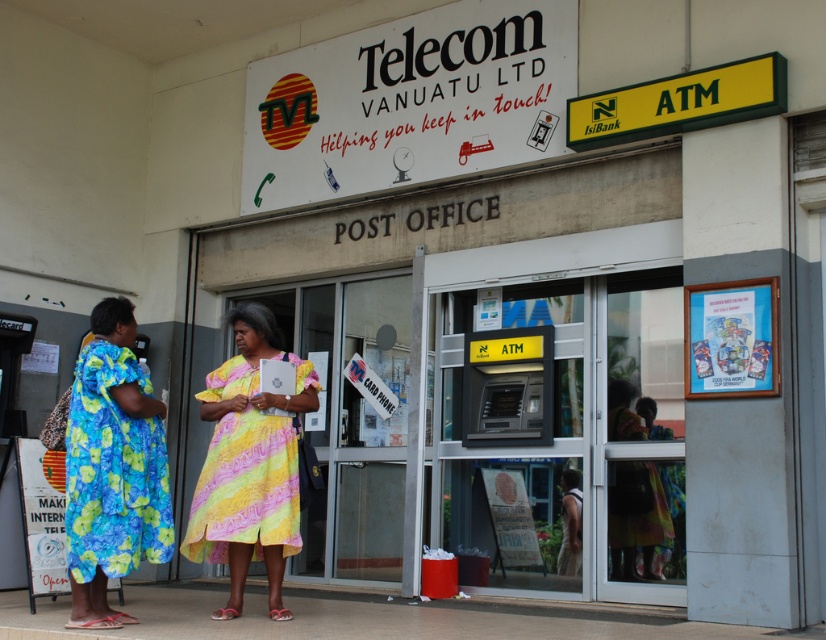
Question: Can you confirm if blue tie-dye fabric dress at left is thinner than yellow floral dress at lower center?

Choices:
 (A) yes
 (B) no

Answer: (B)

Question: Which object is positioned farthest from the blue tie-dye fabric dress at left?

Choices:
 (A) yellow tie-dye dress at center
 (B) yellow floral dress at lower center

Answer: (B)

Question: Among these points, which one is farthest from the camera?

Choices:
 (A) (169, 522)
 (B) (630, 392)
 (C) (219, 388)

Answer: (B)

Question: Does blue tie-dye fabric dress at left lie behind yellow floral dress at lower center?

Choices:
 (A) yes
 (B) no

Answer: (B)

Question: In this image, where is yellow tie-dye dress at center located relative to yellow floral dress at lower center?

Choices:
 (A) left
 (B) right

Answer: (A)

Question: Estimate the real-world distances between objects in this image. Which object is closer to the yellow tie-dye dress at center?

Choices:
 (A) yellow floral dress at lower center
 (B) blue tie-dye fabric dress at left

Answer: (B)